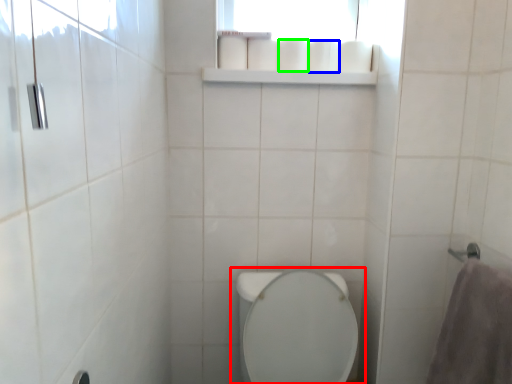
Question: Which object is the farthest from toilet (highlighted by a red box)? Choose among these: toilet paper (highlighted by a blue box) or toilet paper (highlighted by a green box).

Choices:
 (A) toilet paper
 (B) toilet paper

Answer: (A)